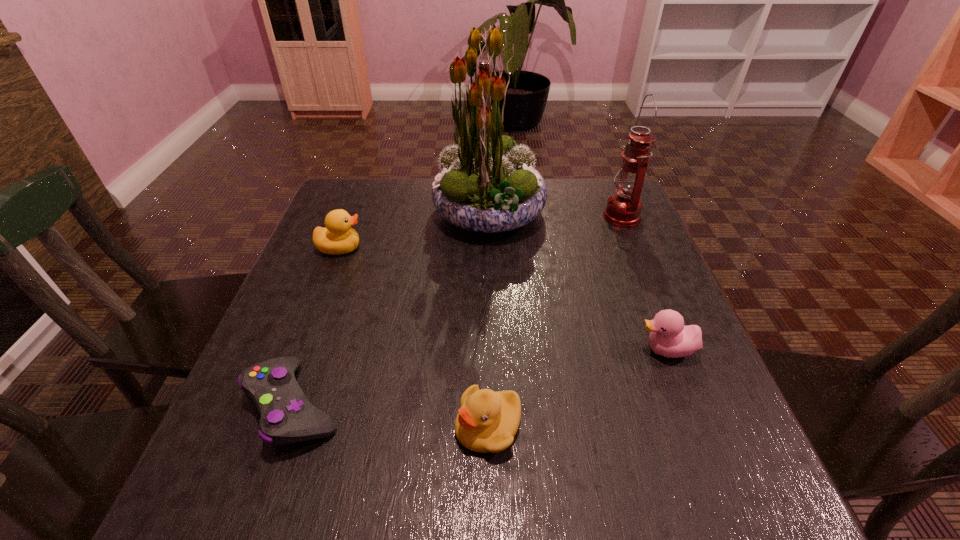
Find the location of a particular element. flower arrangement is located at coordinates (488, 184).

Identify the location of the second tallest object. (623, 209).

This screenshot has width=960, height=540. What are the coordinates of `the leftmost duckling` in the screenshot? It's located at (338, 237).

Where is `the rightmost duckling`? The height and width of the screenshot is (540, 960). the rightmost duckling is located at coordinates (669, 337).

This screenshot has width=960, height=540. I want to click on the nearest duckling, so click(x=487, y=421).

Identify the location of the shortest object. The width and height of the screenshot is (960, 540). click(x=287, y=416).

At what (x,y) coordinates should I click in order to perform the action: click on free point located 0.240m on the front-facing side of the flower arrangement. Please return your answer as a coordinate pair (x, y). This screenshot has height=540, width=960. Looking at the image, I should click on (343, 214).

You are a GUI agent. You are given a task and a screenshot of the screen. Output one action in this format:
    pyautogui.click(x=<x>, y=<y>)
    Task: Click on the vacant area situated 0.260m on the front-facing side of the flower arrangement
    The image size is (960, 540).
    Given the screenshot: What is the action you would take?
    pyautogui.click(x=336, y=214)

You are a GUI agent. You are given a task and a screenshot of the screen. Output one action in this format:
    pyautogui.click(x=<x>, y=<y>)
    Task: Click on the vacant region located 0.050m on the front-facing side of the flower arrangement
    This screenshot has height=540, width=960.
    Given the screenshot: What is the action you would take?
    pyautogui.click(x=415, y=214)

Locate an element on the screen. vacant region located on the left of the oil lamp is located at coordinates (493, 216).